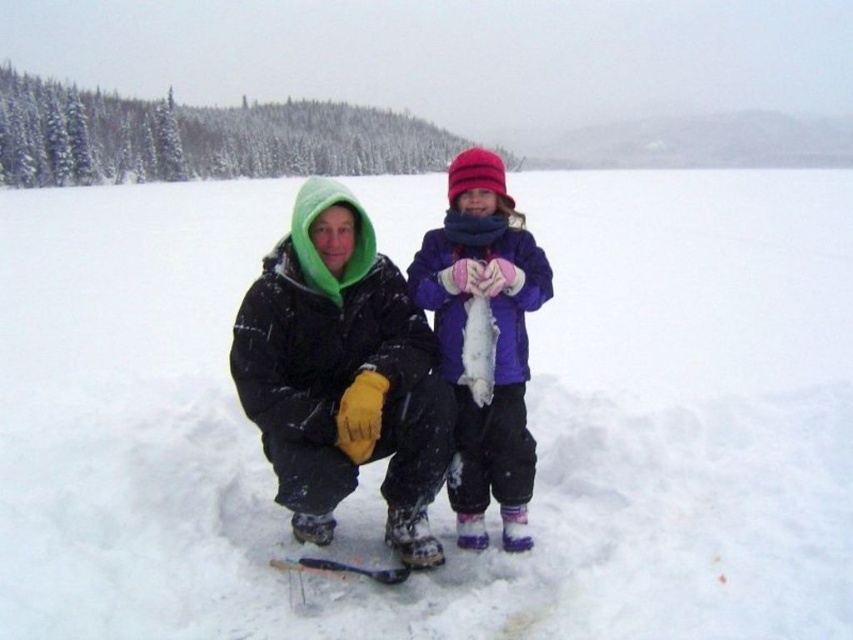
Which is in front, point (685, 461) or point (351, 225)?

Point (351, 225) is in front.

Between point (25, 285) and point (306, 308), which one is positioned behind?

The point (25, 285) is more distant.

Which is behind, point (775, 268) or point (436, 444)?

The point (775, 268) is more distant.

At what (x,y) coordinates should I click in order to perform the action: click on white fluffy snow at center. Please return your answer as a coordinate pair (x, y). This screenshot has width=853, height=640. Looking at the image, I should click on (442, 492).

Does matte black jacket at center have a lesser width compared to purple fleece jacket at center?

In fact, matte black jacket at center might be wider than purple fleece jacket at center.

Measure the distance from matte black jacket at center to purple fleece jacket at center.

matte black jacket at center and purple fleece jacket at center are 16.16 inches apart from each other.

Where is `matte black jacket at center`? The width and height of the screenshot is (853, 640). matte black jacket at center is located at coordinates (344, 374).

Looking at this image, is white fluffy snow at center further to the viewer compared to purple fleece jacket at center?

No, it is in front of purple fleece jacket at center.

Between white fluffy snow at center and purple fleece jacket at center, which one appears on the right side from the viewer's perspective?

purple fleece jacket at center is more to the right.

Find the location of `white fluffy snow at center`. white fluffy snow at center is located at coordinates (442, 492).